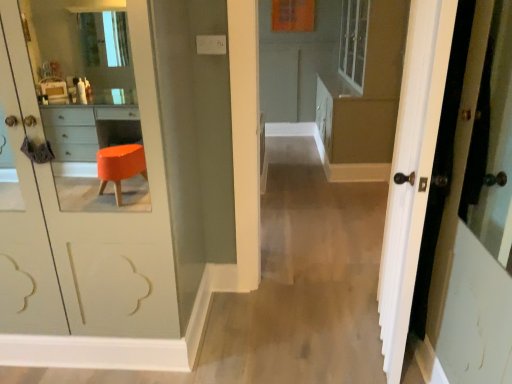
Question: Should I look upward or downward to see white wood door at right?

Choices:
 (A) up
 (B) down

Answer: (B)

Question: Does matte brown dresser at center appear on the left side of white wood door at right?

Choices:
 (A) yes
 (B) no

Answer: (B)

Question: From the image's perspective, would you say matte brown dresser at center is shown under white wood door at right?

Choices:
 (A) no
 (B) yes

Answer: (A)

Question: Is matte brown dresser at center further to camera compared to white wood door at right?

Choices:
 (A) yes
 (B) no

Answer: (A)

Question: Does matte brown dresser at center touch white wood door at right?

Choices:
 (A) no
 (B) yes

Answer: (A)

Question: Is matte brown dresser at center outside white wood door at right?

Choices:
 (A) no
 (B) yes

Answer: (B)

Question: Is matte brown dresser at center in front of white wood door at right?

Choices:
 (A) yes
 (B) no

Answer: (B)

Question: Are white wood door at right and matte brown dresser at center beside each other?

Choices:
 (A) yes
 (B) no

Answer: (B)

Question: Considering the relative sizes of white wood door at right and matte brown dresser at center in the image provided, is white wood door at right shorter than matte brown dresser at center?

Choices:
 (A) yes
 (B) no

Answer: (A)

Question: From the image's perspective, is white wood door at right under matte brown dresser at center?

Choices:
 (A) yes
 (B) no

Answer: (A)

Question: Is matte brown dresser at center at the back of white wood door at right?

Choices:
 (A) no
 (B) yes

Answer: (A)

Question: Is white wood door at right positioned in front of matte brown dresser at center?

Choices:
 (A) no
 (B) yes

Answer: (B)

Question: Does white wood door at right come behind matte brown dresser at center?

Choices:
 (A) no
 (B) yes

Answer: (A)

Question: From a real-world perspective, is white wood door at right physically located above or below matte brown dresser at center?

Choices:
 (A) below
 (B) above

Answer: (A)